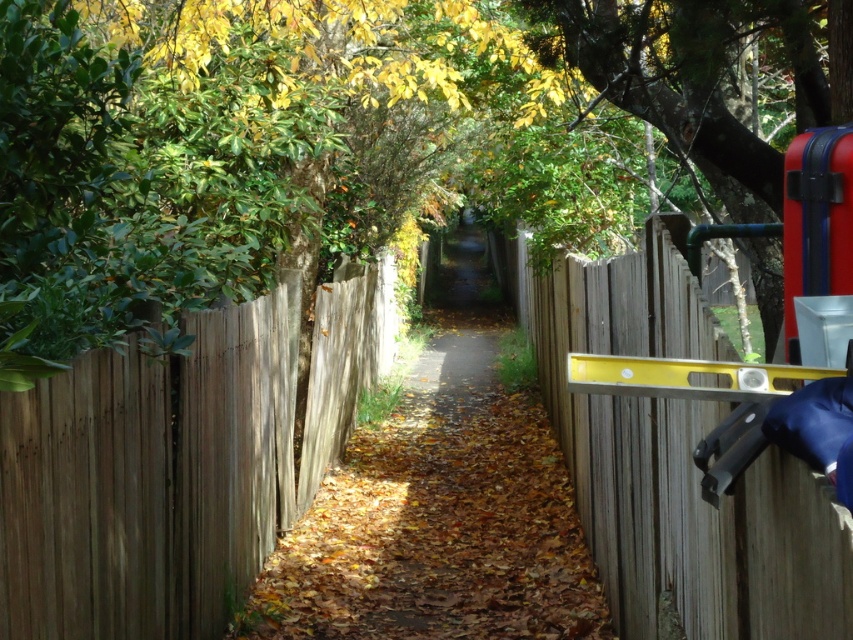
You are a gardener carrying a large wheelbarrow that is 1 meter wide. You need to navigate through the narrow pathway. Can you pass between the brown wooden fence at left and the brown wooden path at center without hitting the fence?

The brown wooden fence at left is thinner than the brown wooden path at center. Since the path is wider than the fence, the 1 meter wide wheelbarrow should be able to pass through the path between the brown wooden fence at left and the brown wooden path at center without hitting the fence.

You are standing at the entrance of the pathway and see two points marked on the ground. The first point is at coordinate point(10, 486) and the second is at point(483, 321). Which point is closer to you?

Point(10, 486) is in front of point(483, 321), so it is closer to you.

You are a maintenance worker carrying a long ladder that is 2 meters in length. You are standing at the entrance of the pathway and see the wooden fence at right and the yellow metallic level at right. Can you tell me which object is closer to you so you can plan your path around them?

The wooden fence at right is in front of the yellow metallic level at right, meaning the wooden fence at right is closer to you. Therefore, you should plan your path around the wooden fence at right first before navigating around the yellow metallic level at right.